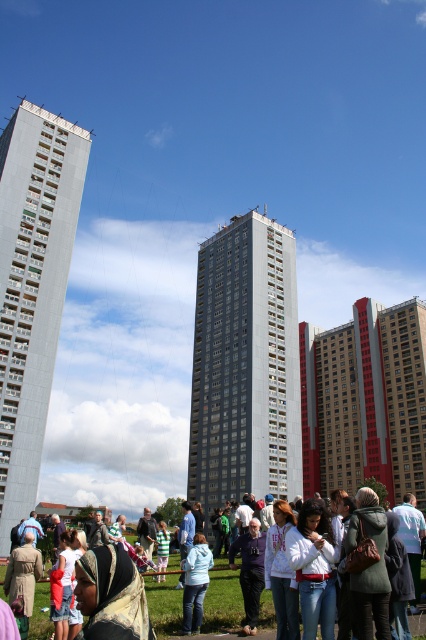
Question: Does gray concrete building at center appear over white cotton shirt at center?

Choices:
 (A) no
 (B) yes

Answer: (B)

Question: Which is farther from the gray concrete building at left?

Choices:
 (A) gray concrete building at center
 (B) light blue denim jacket at center
 (C) white cotton shirt at center

Answer: (B)

Question: Where is white cotton shirt at center located in relation to light blue denim jacket at center in the image?

Choices:
 (A) above
 (B) below

Answer: (B)

Question: Which point appears closest to the camera in this image?

Choices:
 (A) (193, 616)
 (B) (193, 460)
 (C) (28, 154)
 (D) (414, 634)

Answer: (D)

Question: Does gray concrete building at center have a larger size compared to light blue denim jacket at center?

Choices:
 (A) yes
 (B) no

Answer: (A)

Question: Which object is the farthest from the gray concrete building at left?

Choices:
 (A) gray concrete building at center
 (B) white cotton shirt at center

Answer: (A)